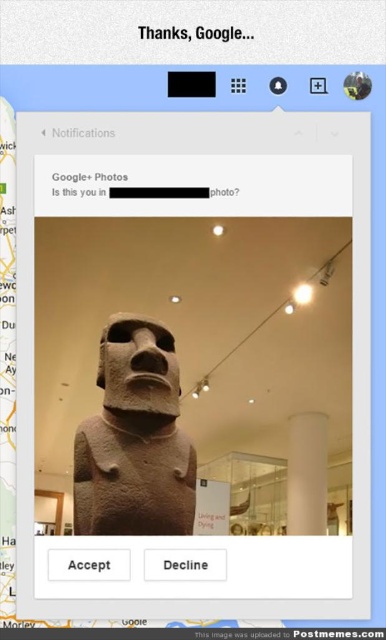
Which is below, brown stone statue at center or white matte website at upper center?

white matte website at upper center is below.

Can you confirm if brown stone statue at center is positioned to the left of white matte website at upper center?

Indeed, brown stone statue at center is positioned on the left side of white matte website at upper center.

Is point (81, 452) farther from camera compared to point (325, 636)?

That is True.

Where is `brown stone statue at center`? brown stone statue at center is located at coordinates (135, 440).

From the picture: Is white glossy pillar at right positioned in front of white matte website at upper center?

No, it is behind white matte website at upper center.

Is point (299, 461) positioned after point (321, 636)?

Yes, point (299, 461) is behind point (321, 636).

You are a GUI agent. You are given a task and a screenshot of the screen. Output one action in this format:
    pyautogui.click(x=<x>, y=<y>)
    Task: Click on the white glossy pillar at right
    
    Given the screenshot: What is the action you would take?
    pyautogui.click(x=306, y=474)

Who is higher up, brown stone statue at center or white glossy pillar at right?

brown stone statue at center

Between brown stone statue at center and white glossy pillar at right, which one has less height?

Standing shorter between the two is brown stone statue at center.

This screenshot has width=386, height=640. Identify the location of brown stone statue at center. (135, 440).